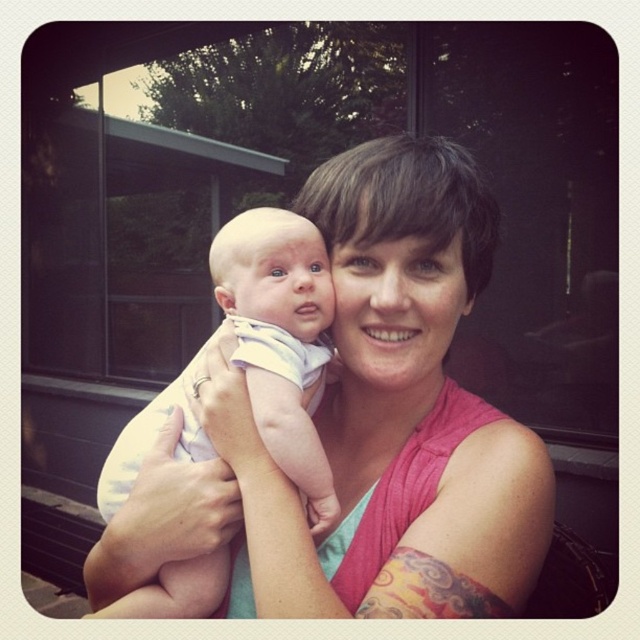
You are a photographer trying to capture a closeup shot of the baby in the image. You notice the pink fabric tank top at center and the light blue cotton onesie at center. Which clothing item is positioned higher on the baby?

The pink fabric tank top at center is much taller than the light blue cotton onesie at center, so the pink fabric tank top at center is positioned higher on the baby.

In the scene shown: You are a photographer taking a picture of the woman and baby. You want to focus on the pink fabric tank top at center and the light blue cotton onesie at center. Which piece of clothing is positioned to the right of the other?

The pink fabric tank top at center is positioned on the right side of light blue cotton onesie at center.

Based on the photo, you are a photographer trying to capture the baby in the center of the frame. The camera has a crosshair targeting system that shows a point at coordinates (362, 428). Which object from the scene should you focus on to ensure the baby is centered?

The pink fabric tank top at center is located at point (362, 428), so focusing on it will center the baby in the frame.